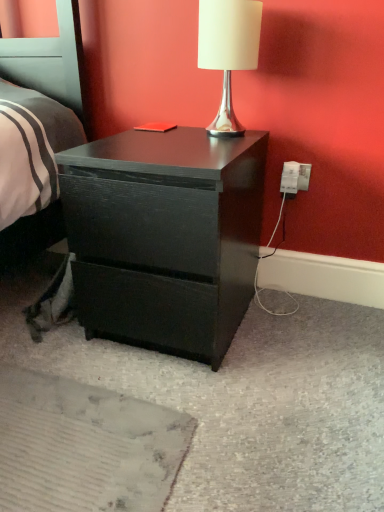
The image size is (384, 512). Find the location of `free point in front of matte black nightstand at center`. free point in front of matte black nightstand at center is located at coordinates (176, 418).